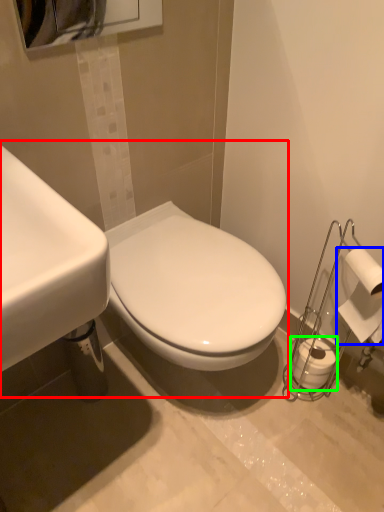
Question: Which object is the farthest from sink (highlighted by a red box)? Choose among these: toilet paper (highlighted by a blue box) or toilet paper (highlighted by a green box).

Choices:
 (A) toilet paper
 (B) toilet paper

Answer: (B)